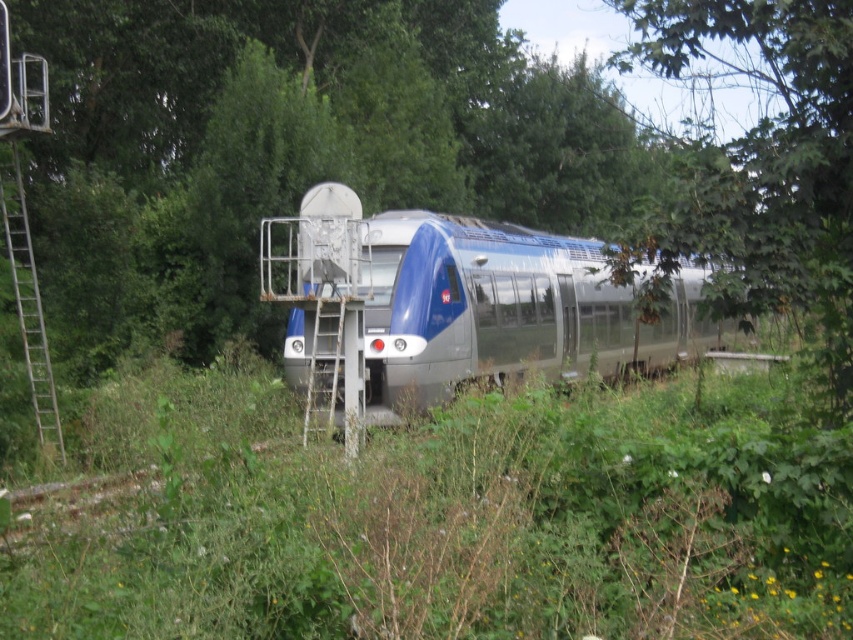
You are a maintenance worker who needs to access the roof of the metallic blue train at center. You see the metallic silver ladder at left nearby. Based on their positions, can you determine if the ladder is positioned to the left or right side of the train?

The metallic blue train at center is to the right of the metallic silver ladder at left, so the ladder is positioned to the left side of the train.

In the scene shown: You are a maintenance worker standing on the ground. You need to access the top of the metallic blue train at center. The ladder is leaning against the train. Is the green grass at center between you and the ladder?

Yes, the green grass at center is between you and the metallic blue train at center, so if the ladder is leaning against the train, the green grass at center would be in front of both you and the ladder, making it necessary to move past the green grass at center to reach the ladder.

You are a maintenance worker who needs to reach the top of the metallic blue train at center. The ladder you have is 10 meters long. Can you safely reach the top using the metallic silver ladder at left?

The metallic blue train at center and metallic silver ladder at left are 11.33 meters apart. Since the ladder is only 10 meters long, it is not long enough to safely reach the top of the train from the current position.